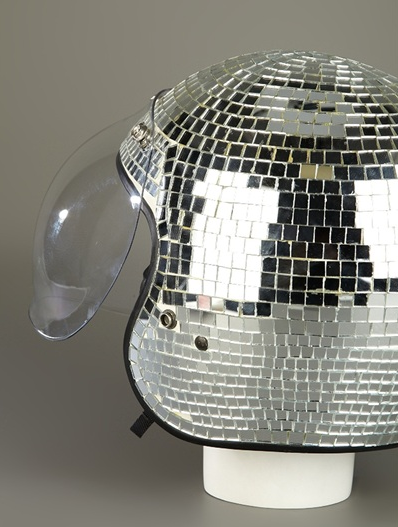
Where is `pink plate`? pink plate is located at coordinates (200, 301).